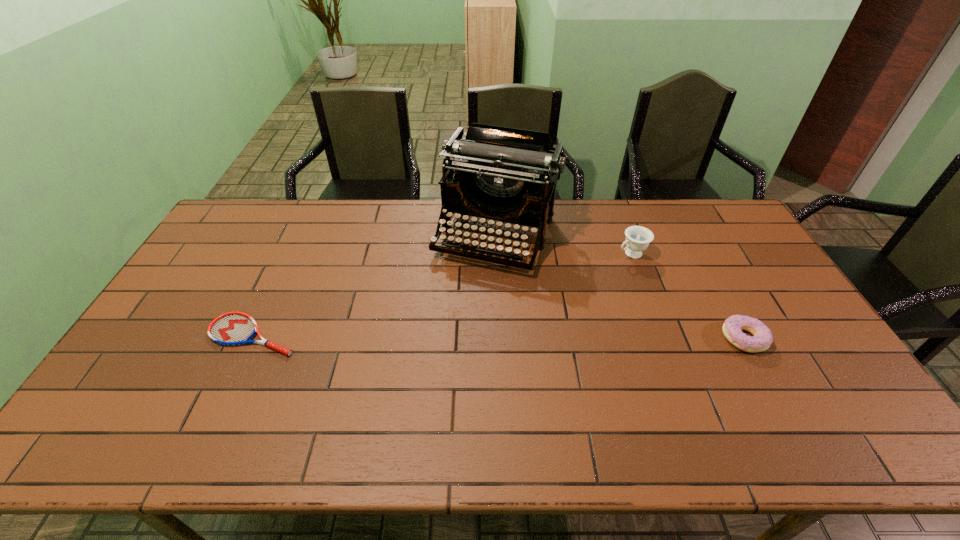
Locate an element on the screen. Image resolution: width=960 pixels, height=540 pixels. free space located 0.100m on the typing side of the tallest object is located at coordinates (469, 299).

Where is `blank space located 0.340m on the typing side of the tallest object`? The height and width of the screenshot is (540, 960). blank space located 0.340m on the typing side of the tallest object is located at coordinates (442, 362).

The width and height of the screenshot is (960, 540). I want to click on blank space located on the typing side of the tallest object, so click(x=447, y=347).

This screenshot has height=540, width=960. What are the coordinates of `vacant region located 0.250m on the side of the teacup with the handle` in the screenshot? It's located at (561, 286).

What are the coordinates of `vacant point located 0.270m on the side of the teacup with the handle` in the screenshot? It's located at (556, 288).

The width and height of the screenshot is (960, 540). Identify the location of free point located on the side of the teacup with the handle. (540, 296).

Locate an element on the screen. object that is at the far edge is located at coordinates (498, 173).

At what (x,y) coordinates should I click in order to perform the action: click on object located in the right edge section of the desktop. Please return your answer as a coordinate pair (x, y). Looking at the image, I should click on (762, 338).

The width and height of the screenshot is (960, 540). Identify the location of vacant area at the far edge of the desktop. (302, 238).

You are a GUI agent. You are given a task and a screenshot of the screen. Output one action in this format:
    pyautogui.click(x=<x>, y=<y>)
    Task: Click on the free location at the near edge
    
    Given the screenshot: What is the action you would take?
    coord(793,409)